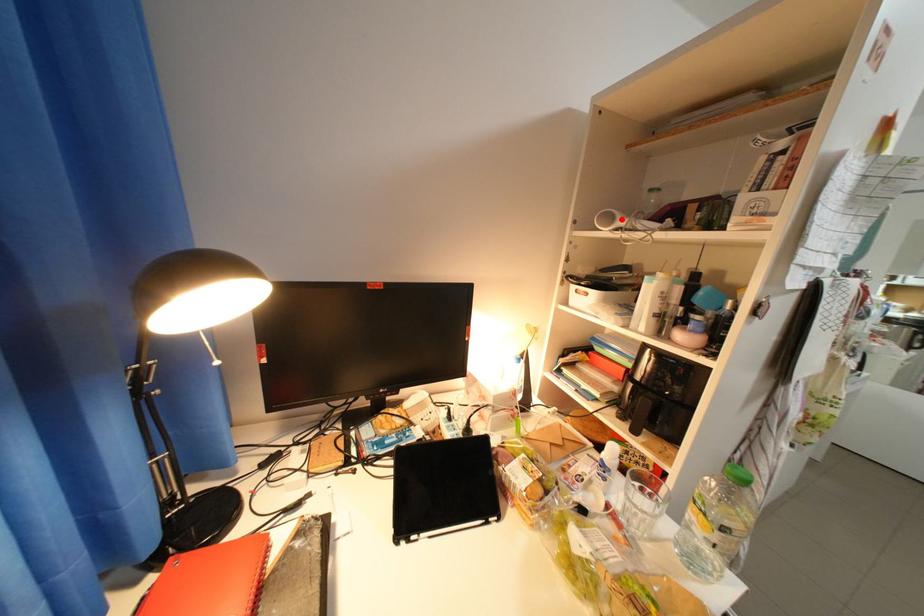
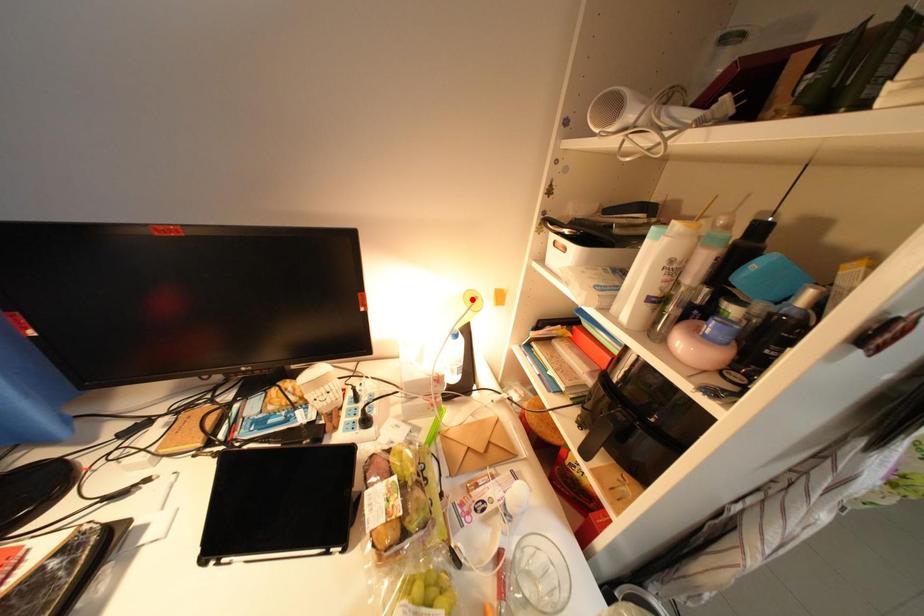
I am providing you with two images of the same scene from different viewpoints. A red point is marked on the first image and another point is marked on the second image. Is the red point in image1 aligned with the point shown in image2?

No